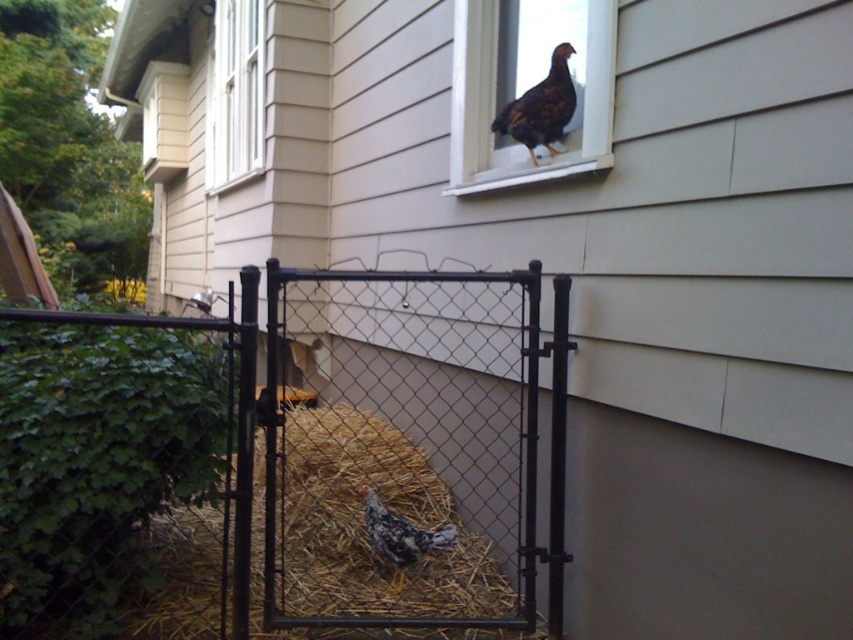
Is point (552, 28) behind point (375, 547)?

No, (552, 28) is in front of (375, 547).

Is point (589, 35) closer to viewer compared to point (456, 525)?

Yes, it is.

The height and width of the screenshot is (640, 853). I want to click on matte glass window at upper center, so click(532, 83).

Is straw bedding at center in front of dark brown speckled chicken at upper center?

No, straw bedding at center is behind dark brown speckled chicken at upper center.

Can you confirm if straw bedding at center is taller than dark brown speckled chicken at upper center?

Yes.

Who is more forward, (x=378, y=440) or (x=532, y=100)?

Point (x=532, y=100) is in front.

Find the location of a particular element. Image resolution: width=853 pixels, height=640 pixels. straw bedding at center is located at coordinates (363, 524).

Can you confirm if black chain-link fence at center is shorter than matte glass window at upper center?

No, black chain-link fence at center is not shorter than matte glass window at upper center.

Does black chain-link fence at center appear under matte glass window at upper center?

Yes.

Does point (450, 589) come in front of point (450, 147)?

Yes, point (450, 589) is in front of point (450, 147).

Find the location of a particular element. The height and width of the screenshot is (640, 853). black chain-link fence at center is located at coordinates (286, 452).